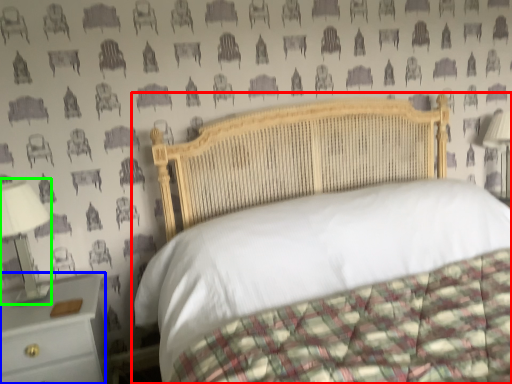
Question: Which object is positioned closest to bed (highlighted by a red box)? Select from nightstand (highlighted by a blue box) and bedside lamp (highlighted by a green box).

Choices:
 (A) nightstand
 (B) bedside lamp

Answer: (A)